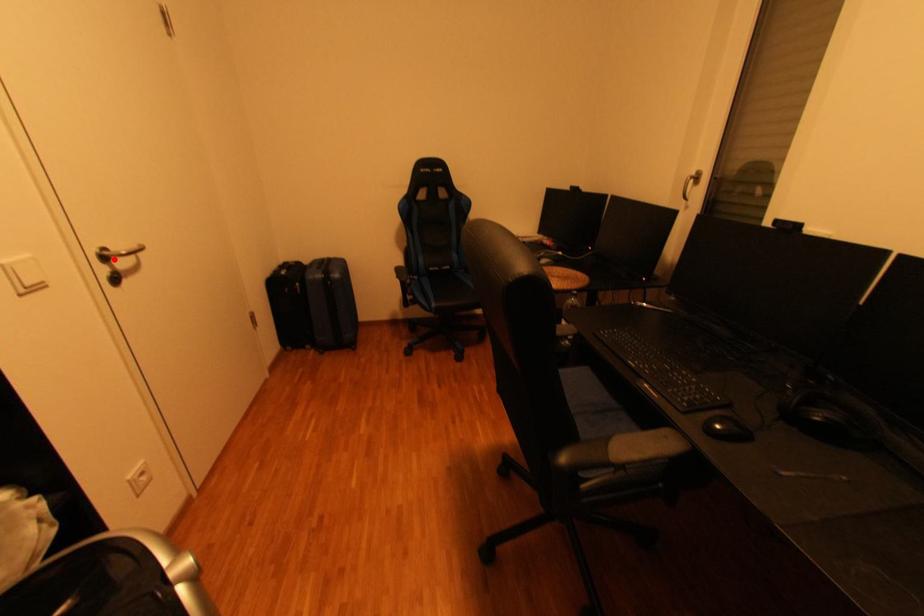
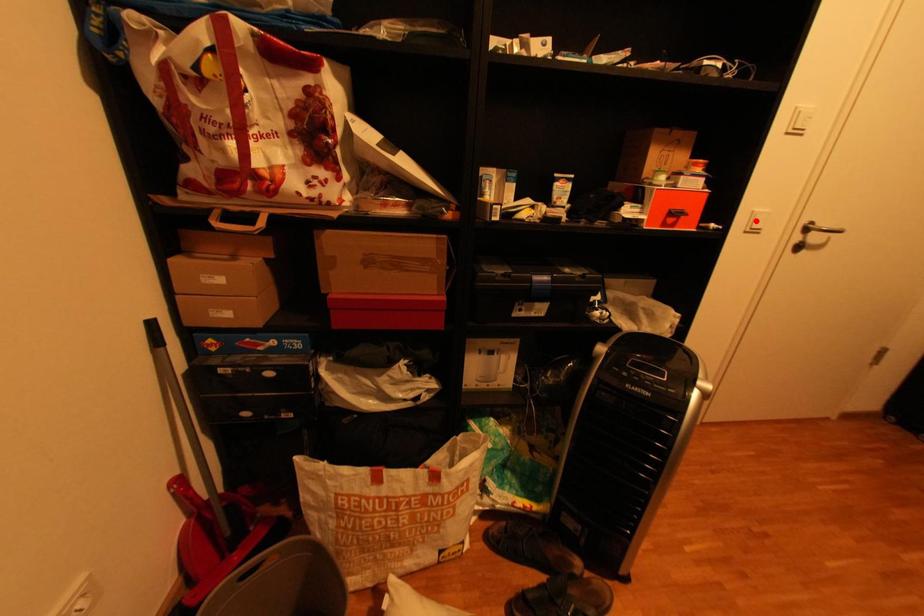
Based on the photo, I am providing you with two images of the same scene from different viewpoints. A red point is marked on the first image and another point is marked on the second image. Are the points marked in image1 and image2 representing the same 3D position?

No